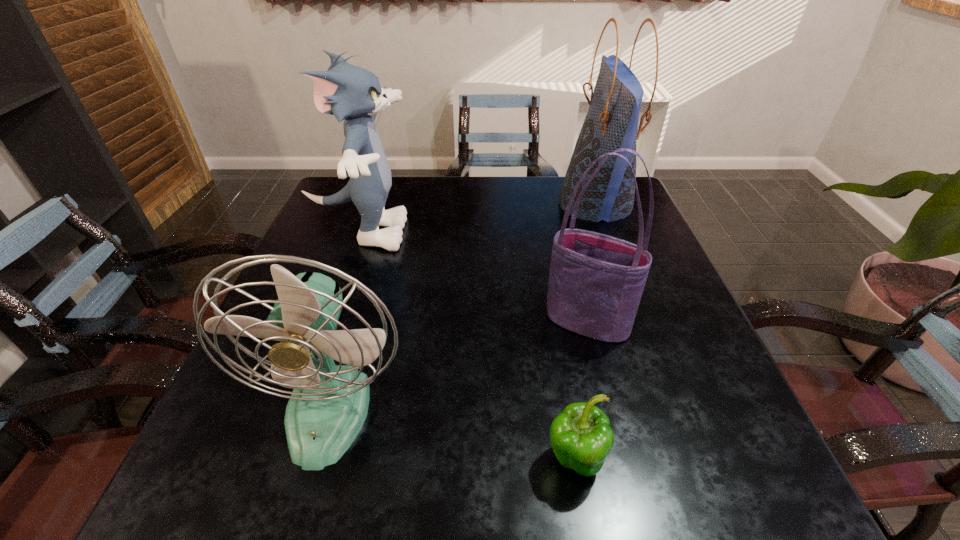
Image resolution: width=960 pixels, height=540 pixels. I want to click on vacant region that satisfies the following two spatial constraints: 1. on the front-facing side of the third nearest object; 2. on the left side of the cat, so click(328, 322).

Locate an element on the screen. The width and height of the screenshot is (960, 540). free spot that satisfies the following two spatial constraints: 1. on the front-facing side of the bell pepper; 2. on the left side of the cat is located at coordinates (279, 461).

Where is `blank space that satisfies the following two spatial constraints: 1. in front of the fan, directing airflow; 2. on the right side of the bell pepper`? blank space that satisfies the following two spatial constraints: 1. in front of the fan, directing airflow; 2. on the right side of the bell pepper is located at coordinates (315, 461).

At what (x,y) coordinates should I click in order to perform the action: click on free location that satisfies the following two spatial constraints: 1. on the back side of the shortest object; 2. on the front-facing side of the cat. Please return your answer as a coordinate pair (x, y). This screenshot has height=540, width=960. Looking at the image, I should click on (536, 233).

At what (x,y) coordinates should I click in order to perform the action: click on vacant space that satisfies the following two spatial constraints: 1. on the back side of the tote bag; 2. on the left side of the bell pepper. Please return your answer as a coordinate pair (x, y). Looking at the image, I should click on (551, 322).

Where is `free point that satisfies the following two spatial constraints: 1. on the front-facing side of the cat; 2. on the right side of the third farthest object`? free point that satisfies the following two spatial constraints: 1. on the front-facing side of the cat; 2. on the right side of the third farthest object is located at coordinates (328, 322).